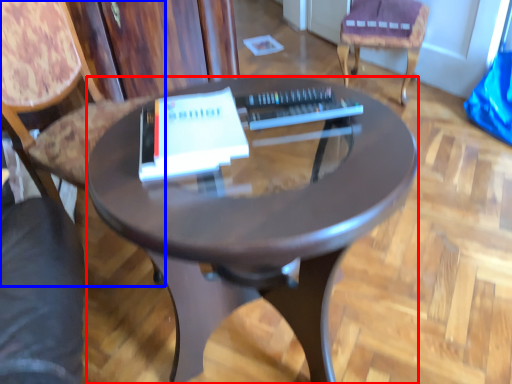
Question: Which point is further to the camera, desk (highlighted by a red box) or chair (highlighted by a blue box)?

Choices:
 (A) desk
 (B) chair

Answer: (B)